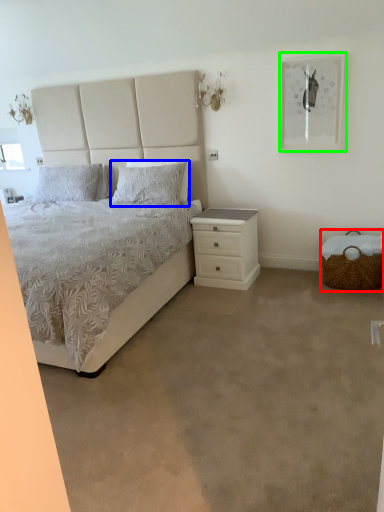
Question: Estimate the real-world distances between objects in this image. Which object is closer to basket (highlighted by a red box), pillow (highlighted by a blue box) or picture frame (highlighted by a green box)?

Choices:
 (A) pillow
 (B) picture frame

Answer: (B)